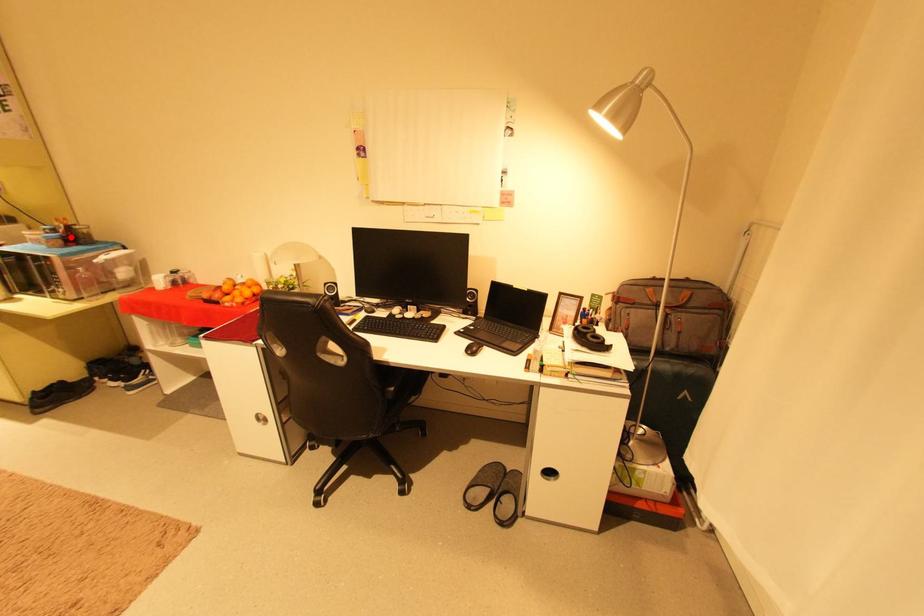
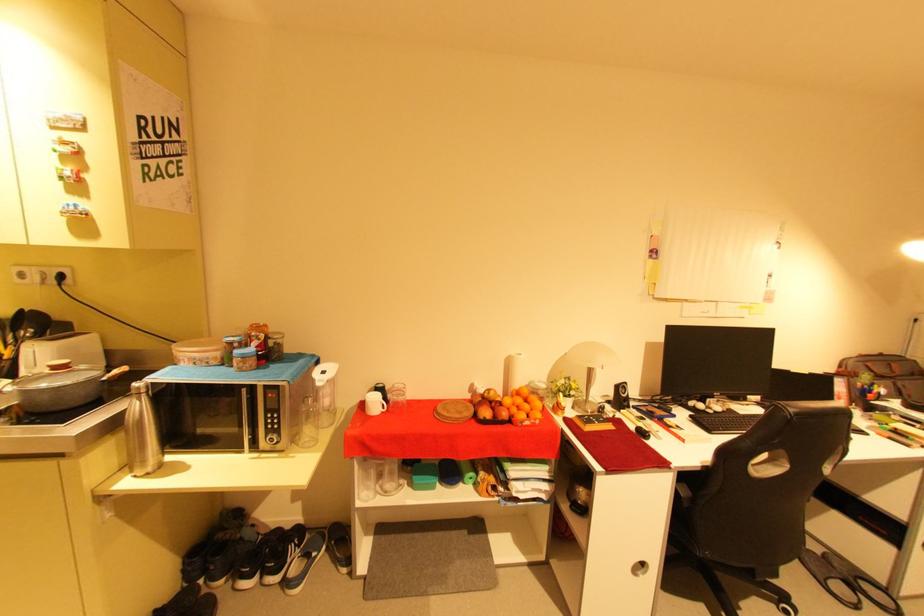
Locate, in the second image, the point that corresponds to the highlighted location in the first image.

(265, 352)